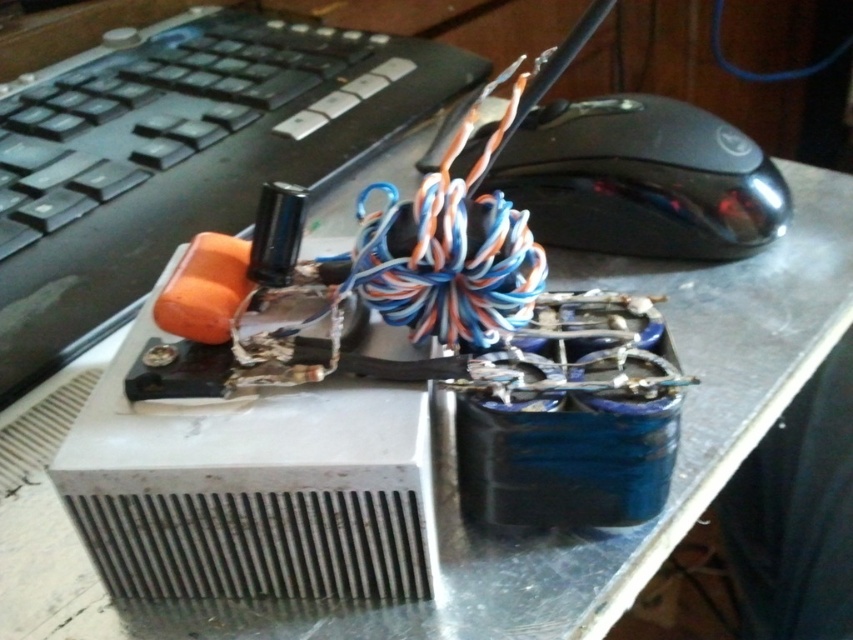
Is black plastic keyboard at upper left thinner than black glossy mouse at upper right?

In fact, black plastic keyboard at upper left might be wider than black glossy mouse at upper right.

The height and width of the screenshot is (640, 853). I want to click on black plastic keyboard at upper left, so click(180, 157).

Identify the location of black plastic keyboard at upper left. (180, 157).